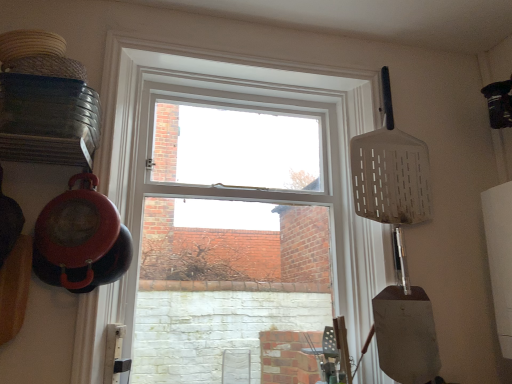
The width and height of the screenshot is (512, 384). What do you see at coordinates (256, 107) in the screenshot?
I see `clear glass window at center` at bounding box center [256, 107].

The image size is (512, 384). What do you see at coordinates (405, 328) in the screenshot? I see `metallic silver shovel at right` at bounding box center [405, 328].

I want to click on white plastic spatula at upper right, so click(x=390, y=171).

Where is `clear glass window at center`? The image size is (512, 384). clear glass window at center is located at coordinates (256, 107).

Is white plastic spatula at upper right directly adjacent to metallic silver shovel at right?

No, white plastic spatula at upper right is not with metallic silver shovel at right.

Measure the distance between white plastic spatula at upper right and metallic silver shovel at right.

They are 33.70 centimeters apart.

Where is `spatula behind the metallic silver shovel at right`? The width and height of the screenshot is (512, 384). spatula behind the metallic silver shovel at right is located at coordinates (390, 171).

Does point (369, 191) appear closer or farther from the camera than point (384, 354)?

Point (369, 191).

Does point (362, 239) come behind point (391, 346)?

Yes, point (362, 239) is farther from viewer.

Is metallic silver shovel at right at the back of clear glass window at center?

No, clear glass window at center's orientation is not away from metallic silver shovel at right.

Is clear glass window at center at the right side of metallic silver shovel at right?

No.

Where is `shovel lying below the white plastic spatula at upper right (from the image's perspective)`? The height and width of the screenshot is (384, 512). shovel lying below the white plastic spatula at upper right (from the image's perspective) is located at coordinates (405, 328).

From a real-world perspective, does metallic silver shovel at right stand above white plastic spatula at upper right?

Incorrect, from a real-world perspective, metallic silver shovel at right is lower than white plastic spatula at upper right.

Is metallic silver shovel at right inside or outside of white plastic spatula at upper right?

metallic silver shovel at right is not enclosed by white plastic spatula at upper right.

Considering the relative sizes of metallic silver shovel at right and white plastic spatula at upper right in the image provided, is metallic silver shovel at right bigger than white plastic spatula at upper right?

No.

Is clear glass window at center to the right of white plastic spatula at upper right from the viewer's perspective?

In fact, clear glass window at center is to the left of white plastic spatula at upper right.

From their relative heights in the image, would you say clear glass window at center is taller or shorter than white plastic spatula at upper right?

Considering their sizes, clear glass window at center has more height than white plastic spatula at upper right.

From a real-world perspective, which is physically above, clear glass window at center or white plastic spatula at upper right?

white plastic spatula at upper right.

Is there a large distance between clear glass window at center and white plastic spatula at upper right?

clear glass window at center is actually quite close to white plastic spatula at upper right.

Is metallic silver shovel at right wider or thinner than clear glass window at center?

metallic silver shovel at right is thinner than clear glass window at center.

Is metallic silver shovel at right not within clear glass window at center?

That's correct, metallic silver shovel at right is outside of clear glass window at center.

From a real-world perspective, does metallic silver shovel at right sit lower than clear glass window at center?

Indeed, from a real-world perspective, metallic silver shovel at right is positioned beneath clear glass window at center.

How different are the orientations of metallic silver shovel at right and clear glass window at center in degrees?

0.00205 degrees separate the facing orientations of metallic silver shovel at right and clear glass window at center.

Looking at their sizes, would you say white plastic spatula at upper right is wider or thinner than clear glass window at center?

Clearly, white plastic spatula at upper right has less width compared to clear glass window at center.

Identify the location of window in front of the white plastic spatula at upper right. Image resolution: width=512 pixels, height=384 pixels. (256, 107).

From a real-world perspective, which object rests below the other?

In real-world perspective, clear glass window at center is lower.

Locate an element on the screen. spatula that is behind the metallic silver shovel at right is located at coordinates (390, 171).

You are a GUI agent. You are given a task and a screenshot of the screen. Output one action in this format:
    pyautogui.click(x=<x>, y=<y>)
    Task: Click on the shovel located below the clear glass window at center (from the image's perspective)
    This screenshot has width=512, height=384.
    Given the screenshot: What is the action you would take?
    pyautogui.click(x=405, y=328)

Based on their spatial positions, is white plastic spatula at upper right or clear glass window at center further from metallic silver shovel at right?

The object further to metallic silver shovel at right is clear glass window at center.

Considering their positions, is metallic silver shovel at right positioned further to white plastic spatula at upper right than clear glass window at center?

Based on the image, metallic silver shovel at right appears to be further to white plastic spatula at upper right.

From the image, which object appears to be farther from clear glass window at center, white plastic spatula at upper right or metallic silver shovel at right?

metallic silver shovel at right lies further to clear glass window at center than the other object.

When comparing their distances from metallic silver shovel at right, does clear glass window at center or white plastic spatula at upper right seem closer?

white plastic spatula at upper right.

From the image, which object appears to be farther from white plastic spatula at upper right, clear glass window at center or metallic silver shovel at right?

Among the two, metallic silver shovel at right is located further to white plastic spatula at upper right.

Considering their positions, is metallic silver shovel at right positioned further to clear glass window at center than white plastic spatula at upper right?

metallic silver shovel at right is further to clear glass window at center.

Where is `shovel between clear glass window at center and white plastic spatula at upper right from left to right`? This screenshot has width=512, height=384. shovel between clear glass window at center and white plastic spatula at upper right from left to right is located at coordinates coord(405,328).